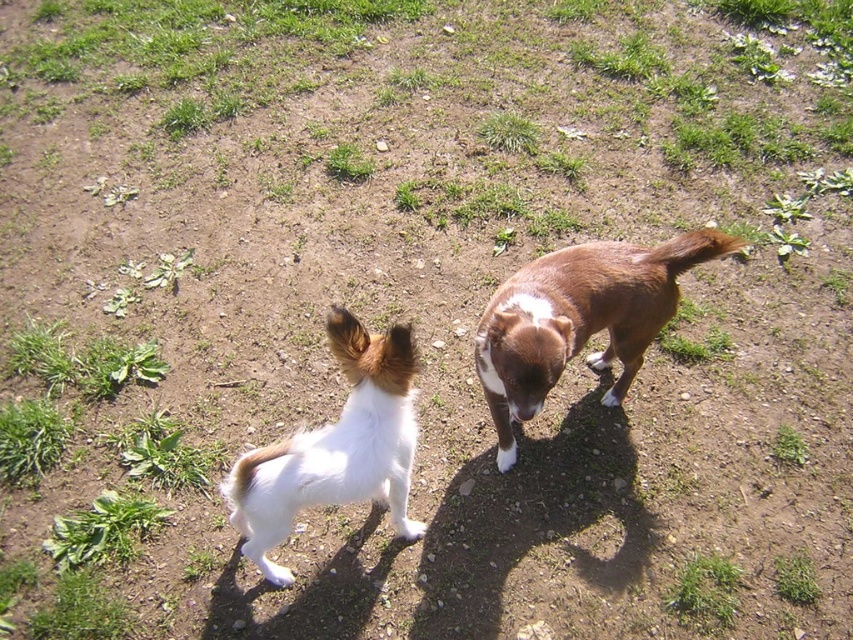
Which is below, white fluffy dog at center or green grass at lower right?

green grass at lower right is lower down.

Is white fluffy dog at center in front of green grass at lower right?

Yes, it is.

Does point (357, 388) lie behind point (683, 588)?

No, it is not.

Locate an element on the screen. white fluffy dog at center is located at coordinates (335, 448).

Is brown furry tail at upper right shorter than white fluffy tail at lower center?

Correct, brown furry tail at upper right is not as tall as white fluffy tail at lower center.

Is brown furry tail at upper right below white fluffy tail at lower center?

Actually, brown furry tail at upper right is above white fluffy tail at lower center.

Between point (691, 256) and point (288, 451), which one is positioned in front?

Point (288, 451) is in front.

The height and width of the screenshot is (640, 853). I want to click on brown furry tail at upper right, so click(x=689, y=250).

Is green leafy grass at lower left bigger than green grass at lower right?

Yes.

Between green leafy grass at lower left and green grass at lower right, which one is positioned higher?

green leafy grass at lower left is above.

Between point (39, 476) and point (692, 605), which one is positioned behind?

Positioned behind is point (39, 476).

This screenshot has height=640, width=853. In order to click on green leafy grass at lower left in this screenshot , I will do `click(30, 440)`.